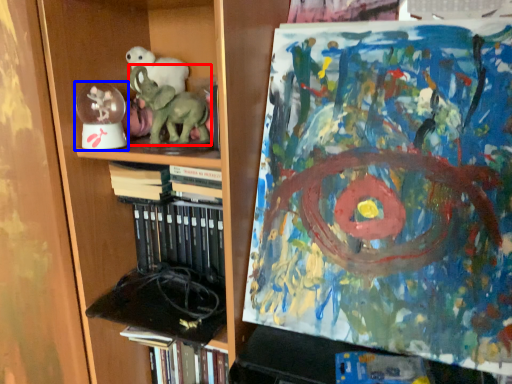
Question: Which point is further to the camera, elephant (highlighted by a red box) or toy (highlighted by a blue box)?

Choices:
 (A) elephant
 (B) toy

Answer: (B)